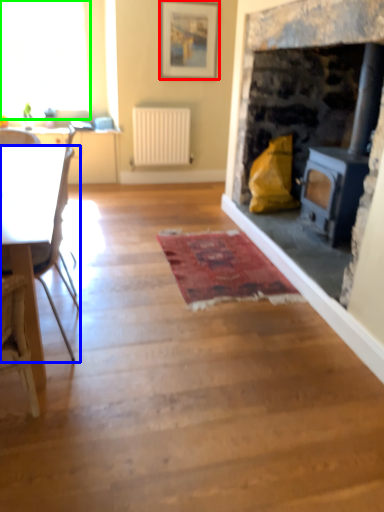
Question: Based on their relative distances, which object is nearer to picture frame (highlighted by a red box)? Choose from chair (highlighted by a blue box) and window (highlighted by a green box).

Choices:
 (A) chair
 (B) window

Answer: (B)